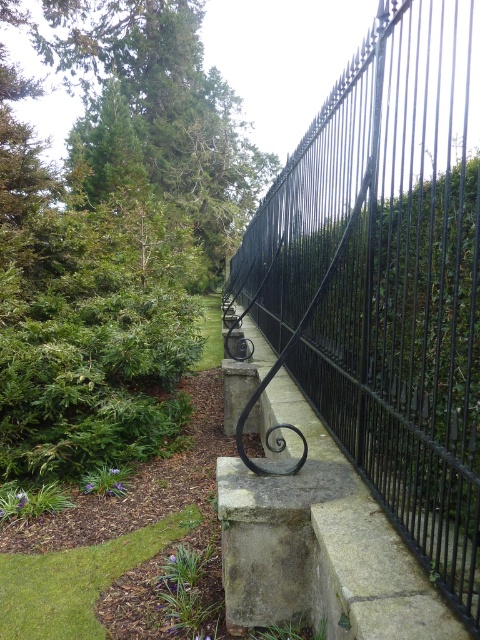
Question: Is black wrought iron fence at right positioned before green leafy tree at upper left?

Choices:
 (A) yes
 (B) no

Answer: (A)

Question: Which point is closer to the camera taking this photo?

Choices:
 (A) (245, 500)
 (B) (107, 28)

Answer: (A)

Question: Can you confirm if black wrought iron fence at right is positioned above green leafy tree at upper left?

Choices:
 (A) no
 (B) yes

Answer: (A)

Question: Which object is farther from the camera taking this photo?

Choices:
 (A) green leafy tree at upper left
 (B) black wrought iron fence at right
 (C) gray concrete at center

Answer: (A)

Question: Which of these objects is positioned farthest from the gray concrete at center?

Choices:
 (A) green leafy tree at upper left
 (B) black wrought iron fence at right

Answer: (A)

Question: Does green leafy tree at upper left lie in front of gray concrete at center?

Choices:
 (A) no
 (B) yes

Answer: (A)